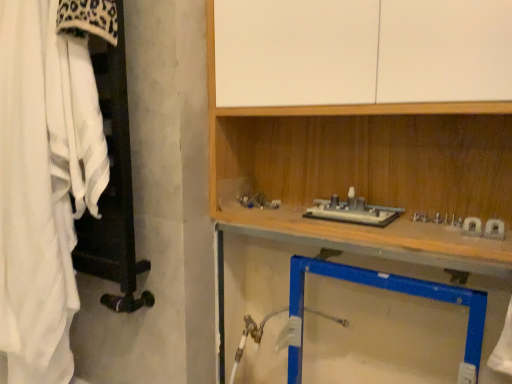
What do you see at coordinates (352, 211) in the screenshot? The width and height of the screenshot is (512, 384). I see `satin silver hardware at center` at bounding box center [352, 211].

Where is `satin silver hardware at center`? This screenshot has height=384, width=512. satin silver hardware at center is located at coordinates pos(352,211).

The image size is (512, 384). In order to click on satin silver hardware at center in this screenshot , I will do `click(352, 211)`.